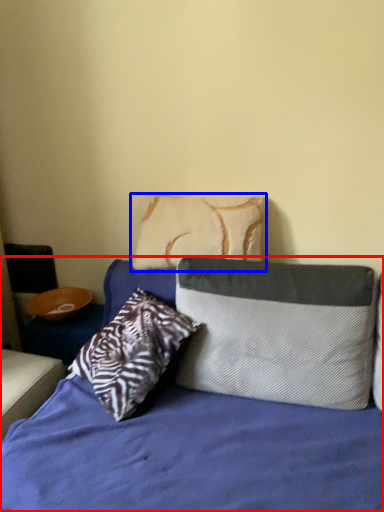
Question: Which object is closer to the camera taking this photo, bed (highlighted by a red box) or pillow (highlighted by a blue box)?

Choices:
 (A) bed
 (B) pillow

Answer: (A)